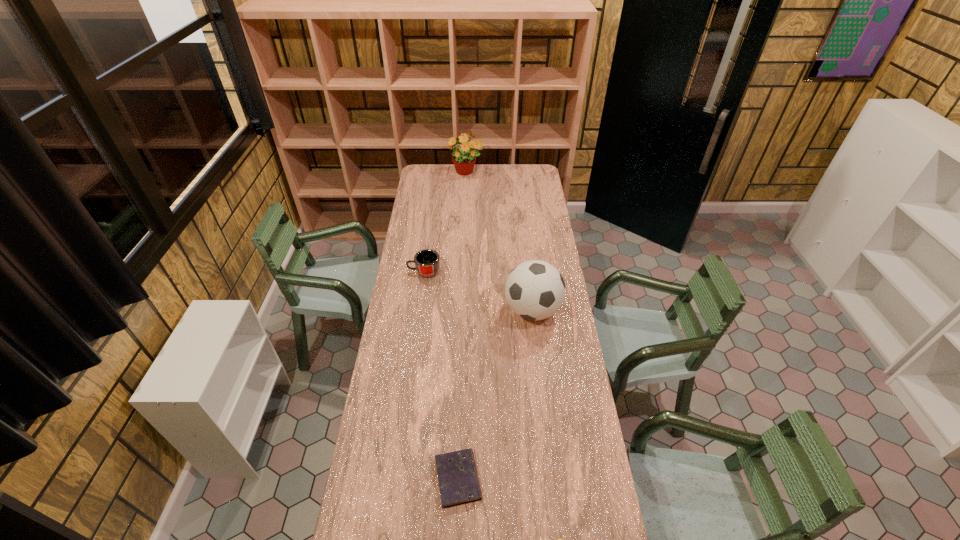
You are a GUI agent. You are given a task and a screenshot of the screen. Output one action in this format:
    pyautogui.click(x=<x>, y=<y>)
    Task: Click on the free spot between the third farthest object and the fourth nearest object
    
    Given the screenshot: What is the action you would take?
    pyautogui.click(x=478, y=291)

The height and width of the screenshot is (540, 960). I want to click on the closest object relative to the third farthest object, so pyautogui.click(x=427, y=261).

The width and height of the screenshot is (960, 540). In order to click on object that is the second nearest to the soccer ball in this screenshot , I will do `click(458, 480)`.

Image resolution: width=960 pixels, height=540 pixels. I want to click on free space that satisfies the following two spatial constraints: 1. on the side of the second nearest object with the handle; 2. on the left side of the third tallest object, so click(396, 478).

Where is `vacant space that satisfies the following two spatial constraints: 1. on the side of the third nearest object with the handle; 2. on the right side of the second farthest object`? The width and height of the screenshot is (960, 540). vacant space that satisfies the following two spatial constraints: 1. on the side of the third nearest object with the handle; 2. on the right side of the second farthest object is located at coordinates (419, 310).

At what (x,y) coordinates should I click in order to perform the action: click on free spot that satisfies the following two spatial constraints: 1. on the back side of the soccer ball; 2. on the right side of the shortest object. Please return your answer as a coordinate pair (x, y). This screenshot has width=960, height=540. Looking at the image, I should click on (464, 310).

This screenshot has width=960, height=540. In order to click on free space that satisfies the following two spatial constraints: 1. on the back side of the third farthest object; 2. on the side of the fourth nearest object with the handle in this screenshot , I will do `click(528, 272)`.